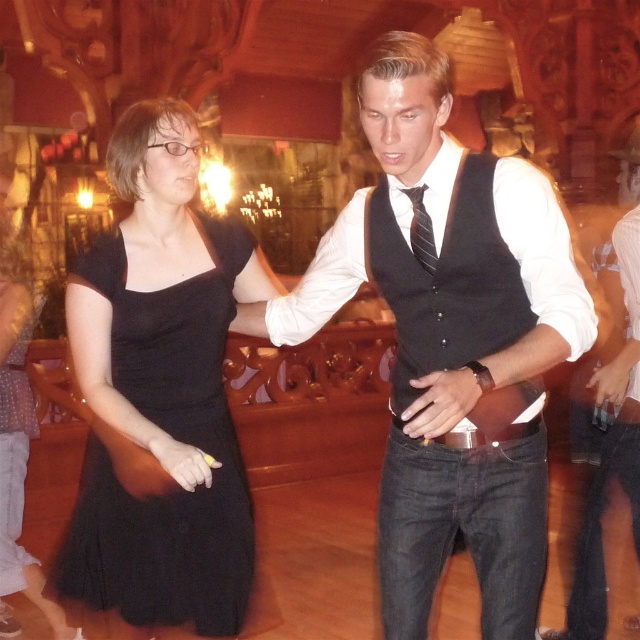
Question: Based on their relative distances, which object is farther from the black matte vest at center?

Choices:
 (A) black tulle dress at center
 (B) black denim jeans at center

Answer: (B)

Question: Estimate the real-world distances between objects in this image. Which object is farther from the black matte vest at center?

Choices:
 (A) black tulle dress at center
 (B) black wool vest at center

Answer: (A)

Question: Is black wool vest at center thinner than striped fabric tie at center?

Choices:
 (A) no
 (B) yes

Answer: (A)

Question: Is black matte vest at center bigger than striped fabric tie at center?

Choices:
 (A) yes
 (B) no

Answer: (A)

Question: Is black wool vest at center thinner than striped fabric tie at center?

Choices:
 (A) no
 (B) yes

Answer: (A)

Question: Which object is the closest to the striped fabric tie at center?

Choices:
 (A) black wool vest at center
 (B) black denim jeans at center
 (C) black tulle dress at center

Answer: (A)